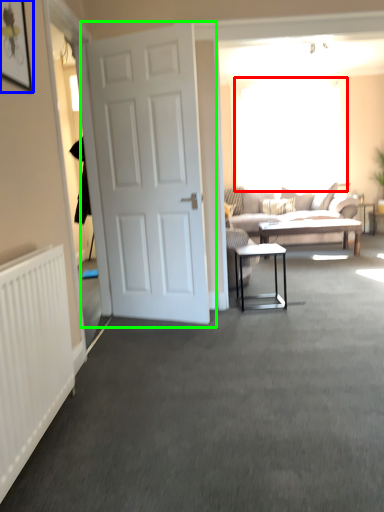
Question: Based on their relative distances, which object is farther from window screen (highlighted by a red box)? Choose from picture frame (highlighted by a blue box) and door (highlighted by a green box).

Choices:
 (A) picture frame
 (B) door

Answer: (A)